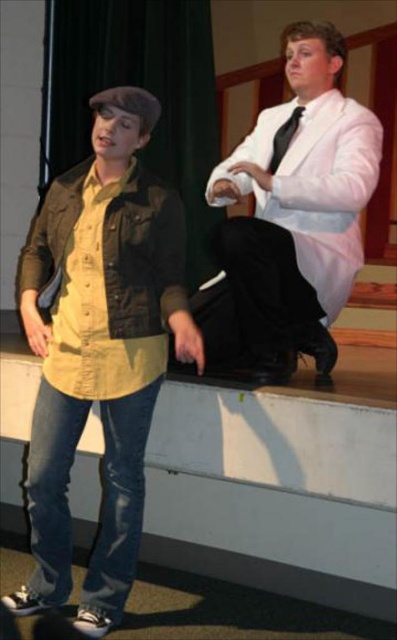
Can you confirm if matte brown leather jacket at left is positioned above white satin suit at upper right?

→ Incorrect, matte brown leather jacket at left is not positioned above white satin suit at upper right.

Can you confirm if matte brown leather jacket at left is bigger than white satin suit at upper right?

Yes, matte brown leather jacket at left is bigger than white satin suit at upper right.

Which is behind, point (102, 422) or point (316, 202)?

The point (102, 422) is behind.

Identify the location of matte brown leather jacket at left. Image resolution: width=397 pixels, height=640 pixels. (100, 349).

The height and width of the screenshot is (640, 397). I want to click on matte brown leather jacket at left, so click(x=100, y=349).

Is point (71, 177) positioned after point (275, 148)?

That is False.

Between point (69, 515) and point (275, 157), which one is positioned behind?

Point (69, 515)

This screenshot has width=397, height=640. Identify the location of matte brown leather jacket at left. (100, 349).

Is point (393, 577) positioned in front of point (256, 264)?

No, it is not.

Is smooth concrete ledge at lower center taller than white satin suit at upper right?

In fact, smooth concrete ledge at lower center may be shorter than white satin suit at upper right.

Which is behind, point (215, 573) or point (327, 237)?

Positioned behind is point (215, 573).

Find the location of a particular element. The image size is (397, 640). smooth concrete ledge at lower center is located at coordinates (279, 484).